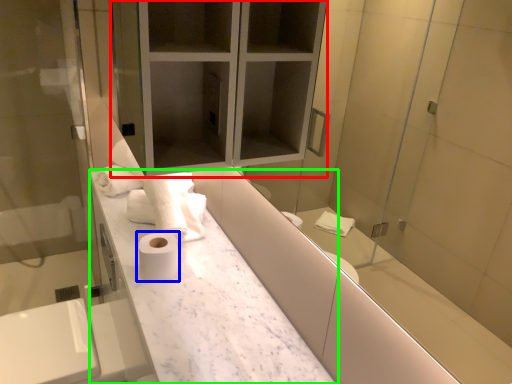
Question: Estimate the real-world distances between objects in this image. Which object is closer to medicine cabinet (highlighted by a red box), toilet paper (highlighted by a blue box) or counter (highlighted by a green box)?

Choices:
 (A) toilet paper
 (B) counter

Answer: (B)